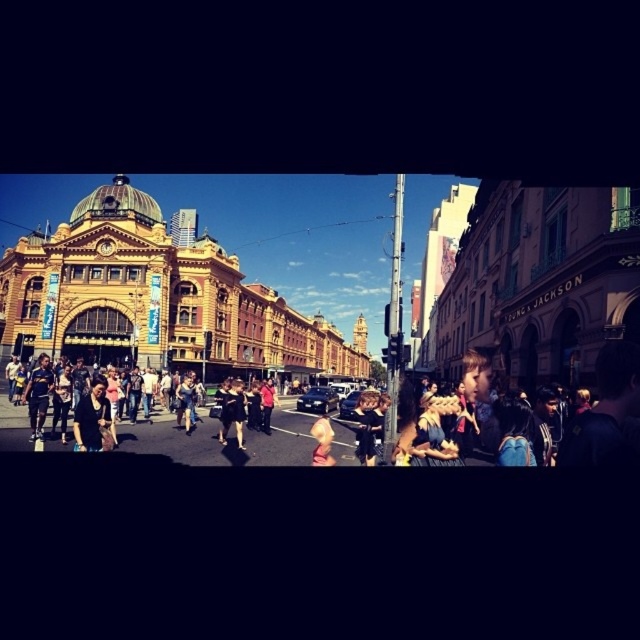
Is point (108, 444) positioned in front of point (316, 456)?

That is True.

In order to click on matte black jacket at center in this screenshot , I will do `click(92, 419)`.

Identify the location of matte black jacket at center. The height and width of the screenshot is (640, 640). (92, 419).